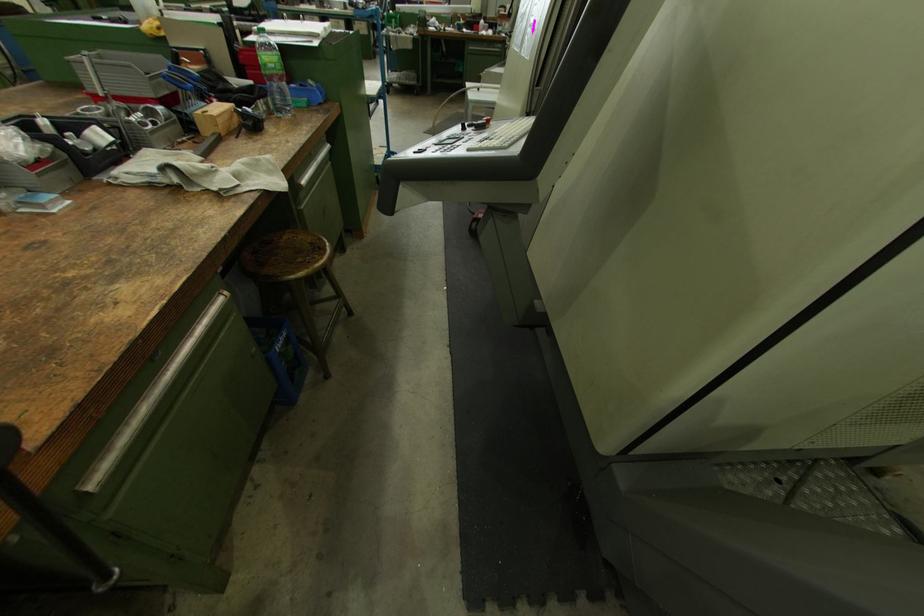
The image size is (924, 616). I want to click on round wooden seat, so click(286, 256).